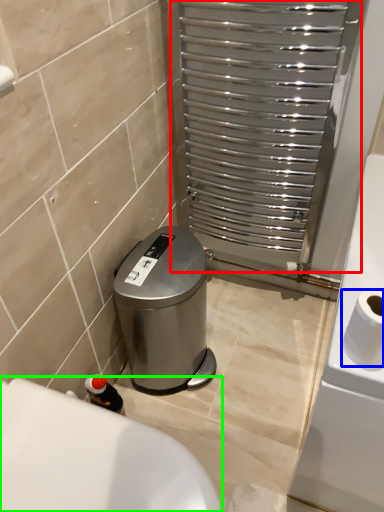
Question: Based on their relative distances, which object is farther from screen door (highlighted by a red box)? Choose from toilet paper (highlighted by a blue box) and bath (highlighted by a green box).

Choices:
 (A) toilet paper
 (B) bath

Answer: (B)